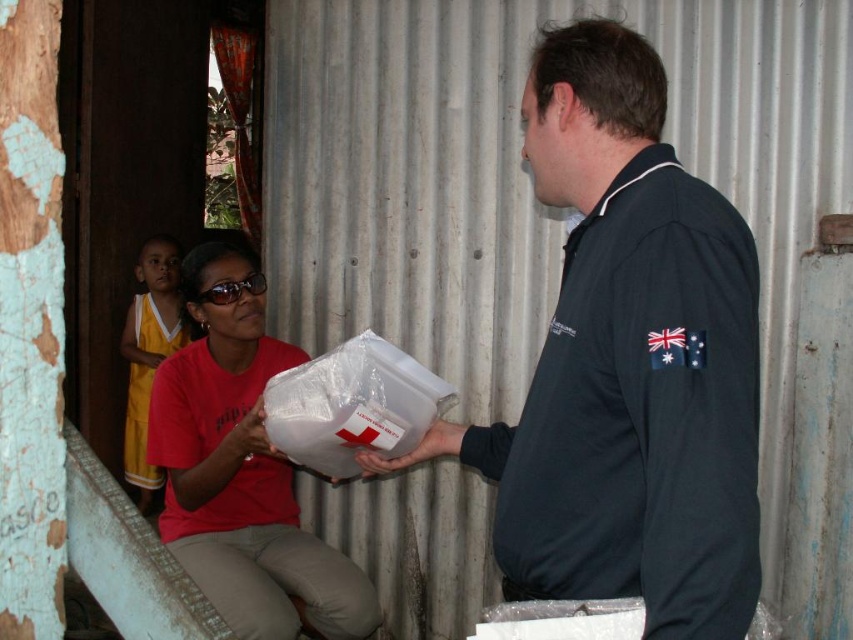
Question: Is dark blue polo shirt at center to the right of yellow jersey at left from the viewer's perspective?

Choices:
 (A) no
 (B) yes

Answer: (B)

Question: Which point is farther to the camera?

Choices:
 (A) (724, 580)
 (B) (154, 332)

Answer: (B)

Question: From the image, what is the correct spatial relationship of dark blue polo shirt at center in relation to yellow jersey at left?

Choices:
 (A) left
 (B) right

Answer: (B)

Question: Can you confirm if dark blue polo shirt at center is smaller than yellow jersey at left?

Choices:
 (A) yes
 (B) no

Answer: (A)

Question: Among these points, which one is nearest to the camera?

Choices:
 (A) (155, 253)
 (B) (653, 429)

Answer: (B)